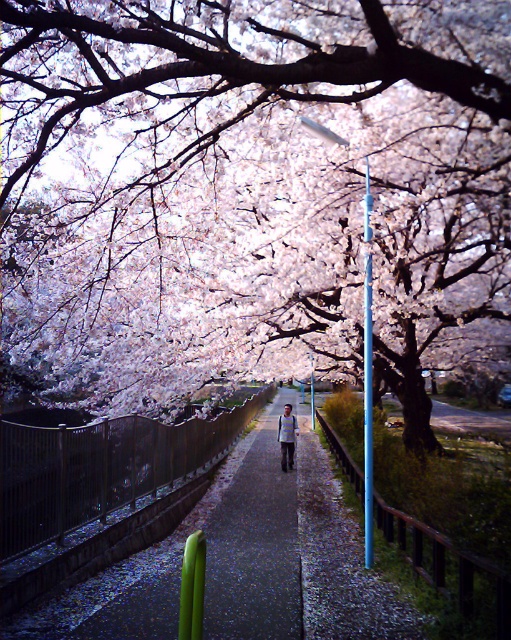
Question: From the image, what is the correct spatial relationship of fluffy pink blossoms at center in relation to smooth plastic pole at center?

Choices:
 (A) above
 (B) below

Answer: (B)

Question: Does fluffy pink blossoms at center appear on the left side of smooth plastic pole at center?

Choices:
 (A) yes
 (B) no

Answer: (A)

Question: Can you confirm if fluffy pink blossoms at center is smaller than smooth plastic pole at center?

Choices:
 (A) no
 (B) yes

Answer: (A)

Question: Which point is closer to the camera?

Choices:
 (A) smooth plastic pole at center
 (B) fluffy pink blossoms at center
 (C) light blue striped shirt at center

Answer: (B)

Question: Which object appears farthest from the camera in this image?

Choices:
 (A) light blue striped shirt at center
 (B) fluffy pink blossoms at center
 (C) smooth plastic pole at center

Answer: (A)

Question: Based on their relative distances, which object is nearer to the smooth plastic pole at center?

Choices:
 (A) light blue striped shirt at center
 (B) fluffy pink blossoms at center

Answer: (B)